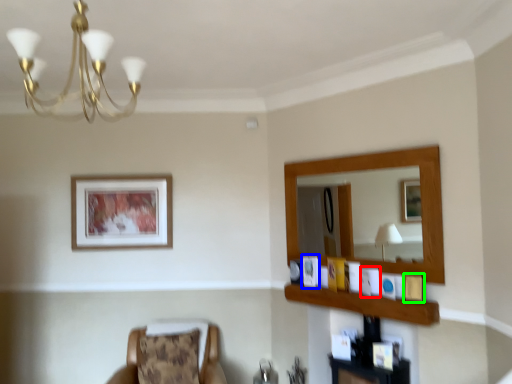
Question: Based on their relative distances, which object is nearer to picture frame (highlighted by a red box)? Choose from picture frame (highlighted by a blue box) and picture frame (highlighted by a green box).

Choices:
 (A) picture frame
 (B) picture frame

Answer: (B)